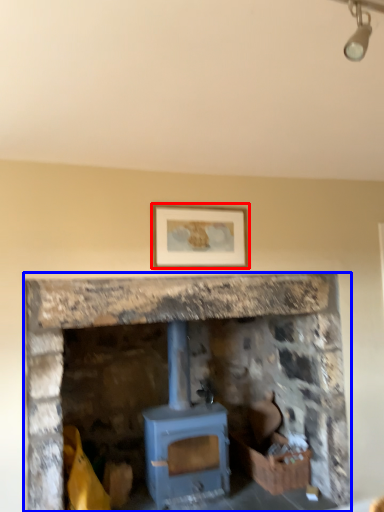
Question: Which point is further to the camera, picture frame (highlighted by a red box) or fireplace (highlighted by a blue box)?

Choices:
 (A) picture frame
 (B) fireplace

Answer: (A)